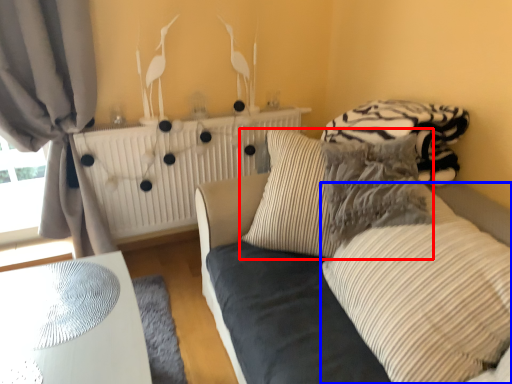
Question: Which object appears farthest to the camera in this image, pillow (highlighted by a red box) or pillow (highlighted by a blue box)?

Choices:
 (A) pillow
 (B) pillow

Answer: (A)